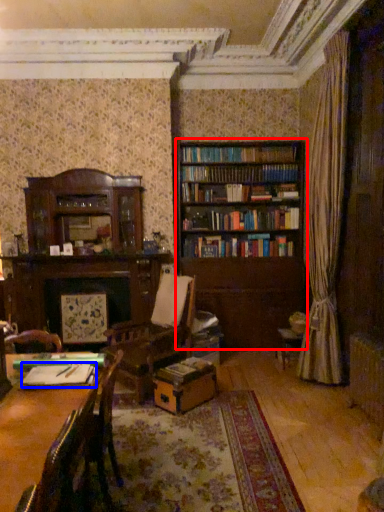
Question: Which point is closer to the camera, bookcase (highlighted by a red box) or book (highlighted by a blue box)?

Choices:
 (A) bookcase
 (B) book

Answer: (B)